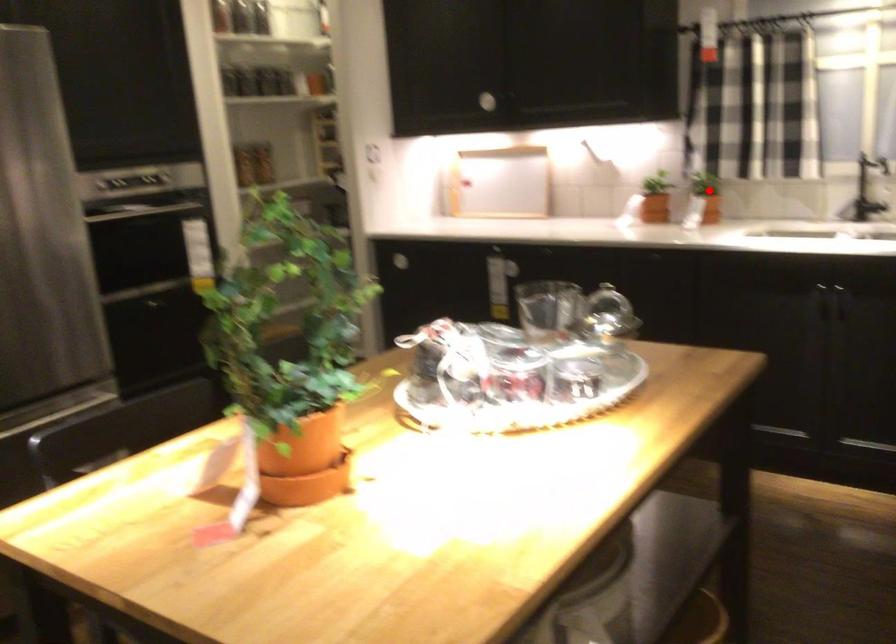
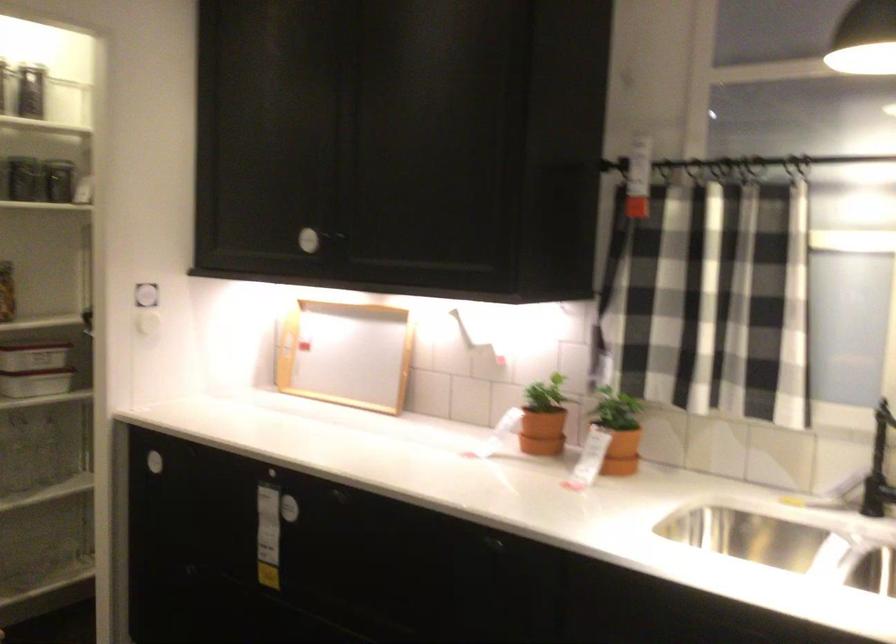
Question: I am providing you with two images of the same scene from different viewpoints. Given a red point in image1, look at the same physical point in image2. Is it:

Choices:
 (A) Closer to the viewpoint
 (B) Farther from the viewpoint

Answer: (A)